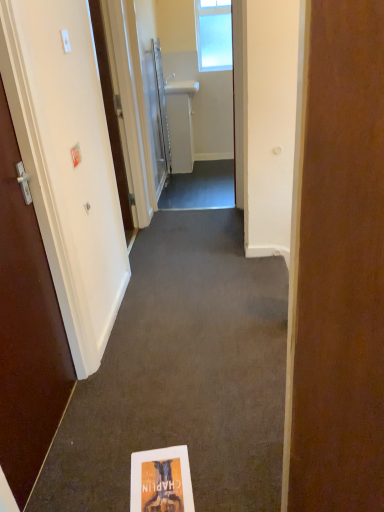
In order to click on white glossy towel rack at upper center, the 1th door viewed from the back in this screenshot , I will do `click(153, 93)`.

Image resolution: width=384 pixels, height=512 pixels. Describe the element at coordinates (27, 331) in the screenshot. I see `matte brown door at left, the second door when ordered from front to back` at that location.

Image resolution: width=384 pixels, height=512 pixels. Find the location of `white glossy sink at upper center`. white glossy sink at upper center is located at coordinates (190, 77).

Where is `clear glass window at upper center`? This screenshot has height=512, width=384. clear glass window at upper center is located at coordinates (213, 34).

What are the coordinates of `white glossy door at left, which appears as the 1th door when viewed from the front` in the screenshot? It's located at (62, 185).

Measure the distance from white glossy sink at center to matte brown door at left, the second door when ordered from front to back.

The distance of white glossy sink at center from matte brown door at left, the second door when ordered from front to back, is 3.55 meters.

Which of these two, white glossy sink at center or matte brown door at left, the second door when ordered from front to back, is smaller?

Smaller between the two is matte brown door at left, the second door when ordered from front to back.

Between white glossy sink at center and matte brown door at left, the second door when ordered from front to back, which one has less height?

With less height is white glossy sink at center.

Can you confirm if white glossy sink at center is positioned to the left of matte brown door at left, the second door when ordered from front to back?

No, white glossy sink at center is not to the left of matte brown door at left, the second door when ordered from front to back.

In order to click on window that appears above the white matte door at left, arranged as the 3th door when viewed from the front (from the image's perspective) in this screenshot , I will do `click(213, 34)`.

Is clear glass window at upper center oriented towards white matte door at left, which appears as the 2th door when viewed from the back?

Yes, clear glass window at upper center is oriented towards white matte door at left, which appears as the 2th door when viewed from the back.

Is clear glass window at upper center inside the boundaries of white matte door at left, arranged as the 3th door when viewed from the front, or outside?

clear glass window at upper center is outside white matte door at left, arranged as the 3th door when viewed from the front.

Considering the relative positions of clear glass window at upper center and white matte door at left, which appears as the 2th door when viewed from the back, in the image provided, is clear glass window at upper center to the left or to the right of white matte door at left, which appears as the 2th door when viewed from the back,?

Based on their positions, clear glass window at upper center is located to the right of white matte door at left, which appears as the 2th door when viewed from the back.

Is clear glass window at upper center at the left side of white paper book at center?

Incorrect, clear glass window at upper center is not on the left side of white paper book at center.

Which of these two, clear glass window at upper center or white paper book at center, is bigger?

Bigger between the two is white paper book at center.

Is clear glass window at upper center placed right next to white paper book at center?

No, clear glass window at upper center is not making contact with white paper book at center.

Considering the sizes of objects matte paper flyer at lower center and white glossy sink at upper center in the image provided, who is bigger, matte paper flyer at lower center or white glossy sink at upper center?

Bigger between the two is white glossy sink at upper center.

Can you confirm if matte paper flyer at lower center is wider than white glossy sink at upper center?

Yes, matte paper flyer at lower center is wider than white glossy sink at upper center.

Identify the location of flyer that is in front of the white glossy sink at upper center. The height and width of the screenshot is (512, 384). (161, 481).

Is matte paper flyer at lower center facing away from white glossy sink at upper center?

No.

Which is behind, point (140, 44) or point (181, 507)?

Positioned behind is point (140, 44).

What's the angular difference between white glossy towel rack at upper center, the 1th door viewed from the back, and matte paper flyer at lower center's facing directions?

The angle between the facing direction of white glossy towel rack at upper center, the 1th door viewed from the back, and the facing direction of matte paper flyer at lower center is 99.4 degrees.

Is white glossy towel rack at upper center, the 1th door viewed from the back, bigger than matte paper flyer at lower center?

Yes, white glossy towel rack at upper center, the 1th door viewed from the back, is bigger than matte paper flyer at lower center.

Is white glossy towel rack at upper center, which is the 4th door in front-to-back order, shorter than matte paper flyer at lower center?

In fact, white glossy towel rack at upper center, which is the 4th door in front-to-back order, may be taller than matte paper flyer at lower center.

In the image, there is a white glossy sink at center. Where is `window above it (from the image's perspective)`? window above it (from the image's perspective) is located at coordinates (213, 34).

Does white glossy sink at center appear on the right side of clear glass window at upper center?

In fact, white glossy sink at center is to the left of clear glass window at upper center.

Between white glossy sink at center and clear glass window at upper center, which one is positioned in front?

white glossy sink at center.

From the image's perspective, is white glossy sink at center on top of clear glass window at upper center?

No.

Is white glossy sink at upper center wider than white glossy door at left, placed as the fourth door when sorted from back to front?

Yes, white glossy sink at upper center is wider than white glossy door at left, placed as the fourth door when sorted from back to front.

Can you tell me how much white glossy sink at upper center and white glossy door at left, which appears as the 1th door when viewed from the front, differ in facing direction?

87.6 degrees separate the facing orientations of white glossy sink at upper center and white glossy door at left, which appears as the 1th door when viewed from the front.

From the picture: Is white glossy door at left, which appears as the 1th door when viewed from the front, surrounded by white glossy sink at upper center?

No.

Is white glossy sink at upper center facing towards white glossy door at left, which appears as the 1th door when viewed from the front?

Yes, white glossy sink at upper center faces towards white glossy door at left, which appears as the 1th door when viewed from the front.

Where is `the 4th door to the left when counting from the white glossy sink at center`? The height and width of the screenshot is (512, 384). the 4th door to the left when counting from the white glossy sink at center is located at coordinates (27, 331).

You are a GUI agent. You are given a task and a screenshot of the screen. Output one action in this format:
    pyautogui.click(x=<x>, y=<y>)
    Task: Click on the 2nd door below the clear glass window at upper center (from the image's perspective)
    Image resolution: width=384 pixels, height=512 pixels.
    Given the screenshot: What is the action you would take?
    pyautogui.click(x=111, y=117)

Based on their spatial positions, is matte paper flyer at lower center or white matte door at left, arranged as the 3th door when viewed from the front, closer to white glossy sink at center?

white matte door at left, arranged as the 3th door when viewed from the front, is positioned closer to the anchor white glossy sink at center.

When comparing their distances from white paper book at center, does white glossy door at left, placed as the fourth door when sorted from back to front, or matte brown door at left, the second door when ordered from front to back, seem further?

matte brown door at left, the second door when ordered from front to back, lies further to white paper book at center than the other object.

Which object lies nearer to the anchor point white matte door at left, which appears as the 2th door when viewed from the back, white glossy sink at center or matte paper flyer at lower center?

The object closer to white matte door at left, which appears as the 2th door when viewed from the back, is matte paper flyer at lower center.

When comparing their distances from matte brown door at left, acting as the 3th door starting from the back, does white glossy towel rack at upper center, which is the 4th door in front-to-back order, or white glossy door at left, placed as the fourth door when sorted from back to front, seem closer?

white glossy door at left, placed as the fourth door when sorted from back to front, lies closer to matte brown door at left, acting as the 3th door starting from the back, than the other object.

When comparing their distances from matte brown door at left, acting as the 3th door starting from the back, does matte paper flyer at lower center or clear glass window at upper center seem closer?

Among the two, matte paper flyer at lower center is located nearer to matte brown door at left, acting as the 3th door starting from the back.

Considering their positions, is white paper book at center positioned closer to white glossy towel rack at upper center, which is the 4th door in front-to-back order, than white glossy sink at center?

white glossy sink at center.

Looking at the image, which one is located closer to white matte door at left, which appears as the 2th door when viewed from the back, matte brown door at left, acting as the 3th door starting from the back, or white glossy door at left, placed as the fourth door when sorted from back to front?

white glossy door at left, placed as the fourth door when sorted from back to front.

Which object lies further to the anchor point white glossy towel rack at upper center, the 1th door viewed from the back, white glossy door at left, which appears as the 1th door when viewed from the front, or white matte door at left, arranged as the 3th door when viewed from the front?

white glossy door at left, which appears as the 1th door when viewed from the front.

This screenshot has width=384, height=512. What are the coordinates of `passage between white matte door at left, which appears as the 2th door when viewed from the back, and white glossy towel rack at upper center, which is the 4th door in front-to-back order, along the z-axis` in the screenshot? It's located at (190, 77).

Find the location of a particular element. The width and height of the screenshot is (384, 512). door located between white matte door at left, which appears as the 2th door when viewed from the back, and clear glass window at upper center in the depth direction is located at coordinates (153, 93).

You are a GUI agent. You are given a task and a screenshot of the screen. Output one action in this format:
    pyautogui.click(x=<x>, y=<y>)
    Task: Click on the flyer between white glossy door at left, placed as the fourth door when sorted from back to front, and white glossy sink at center in the front-back direction
    
    Given the screenshot: What is the action you would take?
    pyautogui.click(x=161, y=481)

Locate an element on the screen. The width and height of the screenshot is (384, 512). flyer between white paper book at center and white glossy sink at upper center along the z-axis is located at coordinates (161, 481).